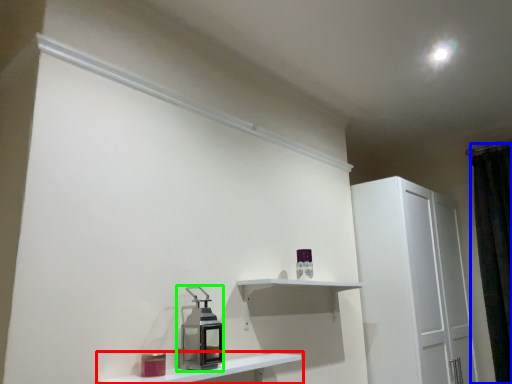
Question: Which object is the closest to the shelf (highlighted by a red box)? Choose among these: curtain (highlighted by a blue box) or appliance (highlighted by a green box).

Choices:
 (A) curtain
 (B) appliance

Answer: (B)